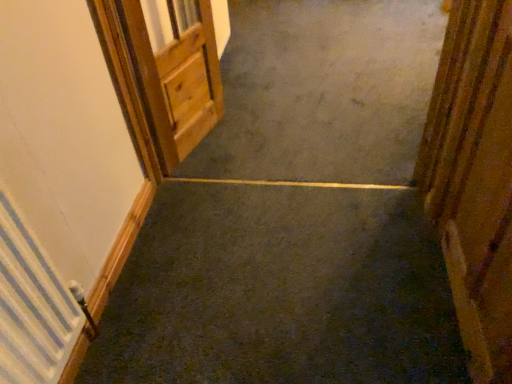
Question: From a real-world perspective, is wooden door at upper left, arranged as the 1th door when viewed from the left, located beneath wooden door at right, the second door in the back-to-front sequence?

Choices:
 (A) no
 (B) yes

Answer: (B)

Question: Is wooden door at upper left, arranged as the 1th door when viewed from the left, further to the viewer compared to wooden door at right, the first door when ordered from front to back?

Choices:
 (A) yes
 (B) no

Answer: (A)

Question: Is wooden door at upper left, arranged as the 1th door when viewed from the left, smaller than wooden door at right, the 2th door when ordered from left to right?

Choices:
 (A) yes
 (B) no

Answer: (B)

Question: From the image's perspective, is wooden door at upper left, marked as the first door in a back-to-front arrangement, under wooden door at right, marked as the first door in a right-to-left arrangement?

Choices:
 (A) yes
 (B) no

Answer: (B)

Question: Is there a large distance between wooden door at upper left, arranged as the 1th door when viewed from the left, and wooden door at right, the second door in the back-to-front sequence?

Choices:
 (A) no
 (B) yes

Answer: (B)

Question: From the image's perspective, is white textured radiator at left above or below wooden door at upper left, arranged as the 1th door when viewed from the left?

Choices:
 (A) below
 (B) above

Answer: (A)

Question: In terms of size, does white textured radiator at left appear bigger or smaller than wooden door at upper left, arranged as the 1th door when viewed from the left?

Choices:
 (A) small
 (B) big

Answer: (A)

Question: Would you say white textured radiator at left is to the left or to the right of wooden door at upper left, placed as the 2th door when sorted from front to back, in the picture?

Choices:
 (A) left
 (B) right

Answer: (A)

Question: From a real-world perspective, is white textured radiator at left positioned above or below wooden door at upper left, placed as the 2th door when sorted from front to back?

Choices:
 (A) above
 (B) below

Answer: (A)

Question: Would you say wooden door at right, marked as the first door in a right-to-left arrangement, is to the left or to the right of white textured radiator at left in the picture?

Choices:
 (A) left
 (B) right

Answer: (B)

Question: From the image's perspective, is wooden door at right, the 2th door when ordered from left to right, positioned above or below white textured radiator at left?

Choices:
 (A) below
 (B) above

Answer: (B)

Question: Considering the positions of wooden door at right, the first door when ordered from front to back, and white textured radiator at left in the image, is wooden door at right, the first door when ordered from front to back, bigger or smaller than white textured radiator at left?

Choices:
 (A) big
 (B) small

Answer: (B)

Question: Looking at their shapes, would you say wooden door at right, the second door in the back-to-front sequence, is wider or thinner than white textured radiator at left?

Choices:
 (A) wide
 (B) thin

Answer: (B)

Question: In terms of width, does wooden door at upper left, the 2th door in the right-to-left sequence, look wider or thinner when compared to white textured radiator at left?

Choices:
 (A) thin
 (B) wide

Answer: (B)

Question: Is point (141, 8) closer or farther from the camera than point (40, 314)?

Choices:
 (A) farther
 (B) closer

Answer: (A)